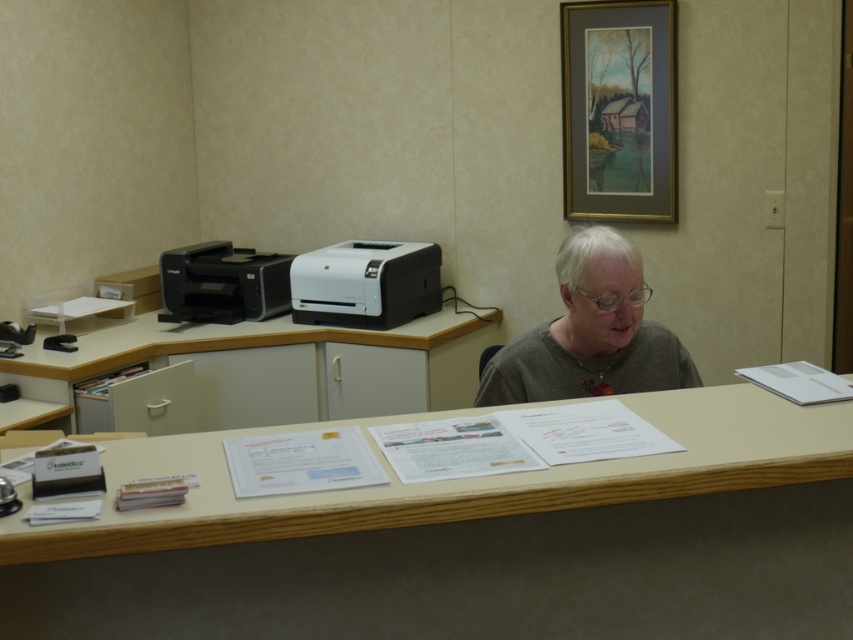
Between point (241, 333) and point (616, 250), which one is positioned in front?

Positioned in front is point (616, 250).

Is wooden table at lower center to the right of gray matte shirt at center from the viewer's perspective?

In fact, wooden table at lower center is to the left of gray matte shirt at center.

At what (x,y) coordinates should I click in order to perform the action: click on wooden table at lower center. Please return your answer as a coordinate pair (x, y). Looking at the image, I should click on (279, 362).

Is gray matte shirt at center to the left of matte black printer at left from the viewer's perspective?

No, gray matte shirt at center is not to the left of matte black printer at left.

Does point (548, 378) come closer to viewer compared to point (282, 307)?

Yes.

Locate an element on the screen. The height and width of the screenshot is (640, 853). gray matte shirt at center is located at coordinates (590, 333).

Is point (283, 339) less distant than point (247, 320)?

Yes, it is in front of point (247, 320).

Who is more forward, (x=297, y=388) or (x=265, y=288)?

Point (x=297, y=388) is more forward.

Image resolution: width=853 pixels, height=640 pixels. I want to click on wooden table at lower center, so click(x=279, y=362).